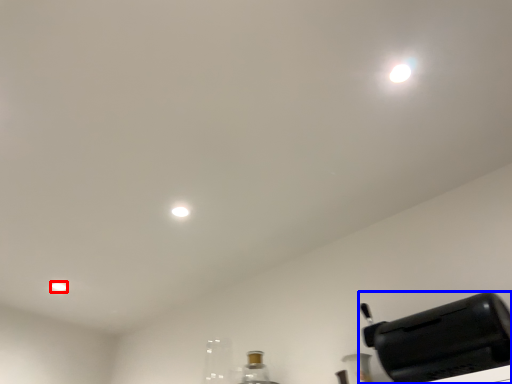
Question: Which object is closer to the camera taking this photo, dot (highlighted by a red box) or home appliance (highlighted by a blue box)?

Choices:
 (A) dot
 (B) home appliance

Answer: (B)